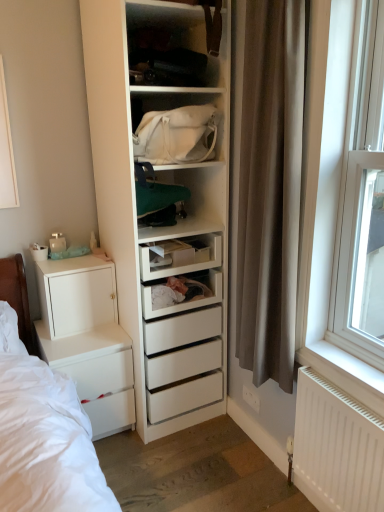
Where is `free space in front of white matte cabinet at lower left`? free space in front of white matte cabinet at lower left is located at coordinates (72, 344).